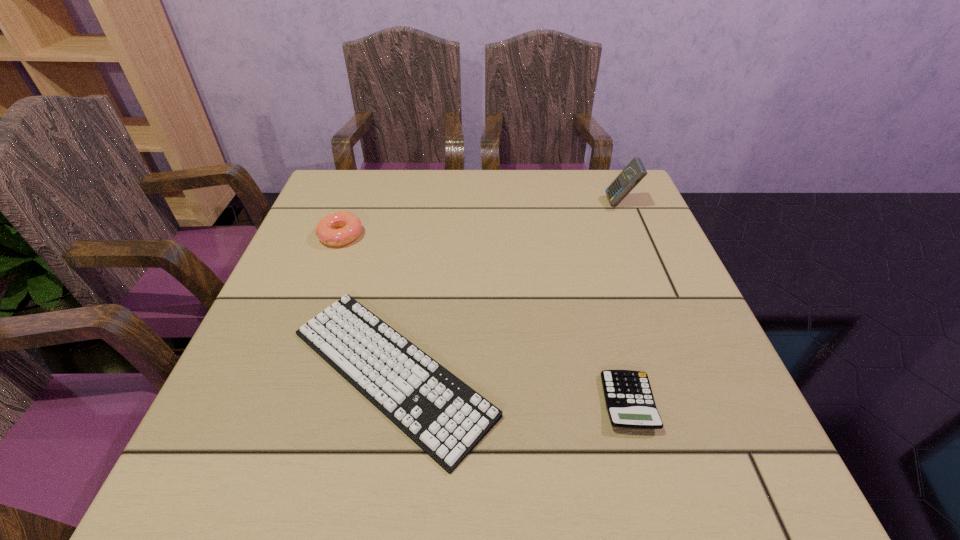
The image size is (960, 540). What are the coordinates of `free point between the farther calculator and the computer keyboard` in the screenshot? It's located at (506, 287).

This screenshot has width=960, height=540. In order to click on vacant point located between the shorter calculator and the second tallest object in this screenshot , I will do `click(485, 319)`.

Find the location of `free space between the computer keyboard and the doughnut`. free space between the computer keyboard and the doughnut is located at coordinates (366, 304).

Locate an element on the screen. The height and width of the screenshot is (540, 960). vacant region between the doughnut and the left calculator is located at coordinates (485, 319).

Locate an element on the screen. free space between the computer keyboard and the nearer calculator is located at coordinates (510, 387).

This screenshot has width=960, height=540. Identify the location of object that is the closest to the second farthest object. pyautogui.click(x=446, y=418).

Select which object is the second closest to the second farthest object. Please provide its 2D coordinates. Your answer should be formatted as a tuple, i.e. [(x, y)], where the tuple contains the x and y coordinates of a point satisfying the conditions above.

[(629, 400)]

Where is `blank area in the image that satisfies the following two spatial constraints: 1. on the front side of the second object from right to left; 2. on the right side of the second farthest object`? The image size is (960, 540). blank area in the image that satisfies the following two spatial constraints: 1. on the front side of the second object from right to left; 2. on the right side of the second farthest object is located at coordinates [x=278, y=402].

Find the location of `vacant space that satisfies the following two spatial constraints: 1. on the front side of the third shortest object; 2. on the left side of the nearer calculator`. vacant space that satisfies the following two spatial constraints: 1. on the front side of the third shortest object; 2. on the left side of the nearer calculator is located at coordinates (278, 402).